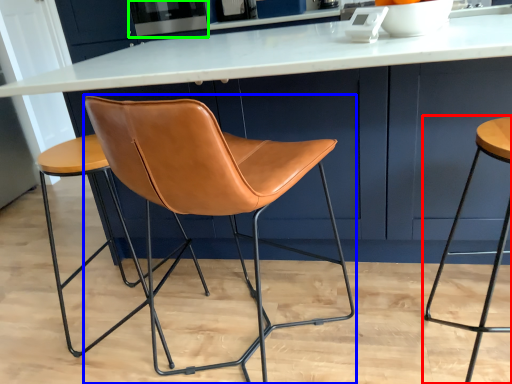
Question: Which object is the closest to the stool (highlighted by a red box)? Choose among these: chair (highlighted by a blue box) or appliance (highlighted by a green box).

Choices:
 (A) chair
 (B) appliance

Answer: (A)